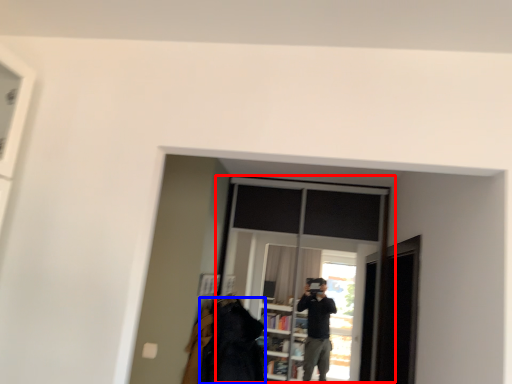
Question: Which object is further to the camera taking this photo, window (highlighted by a red box) or clothing (highlighted by a blue box)?

Choices:
 (A) window
 (B) clothing

Answer: (A)